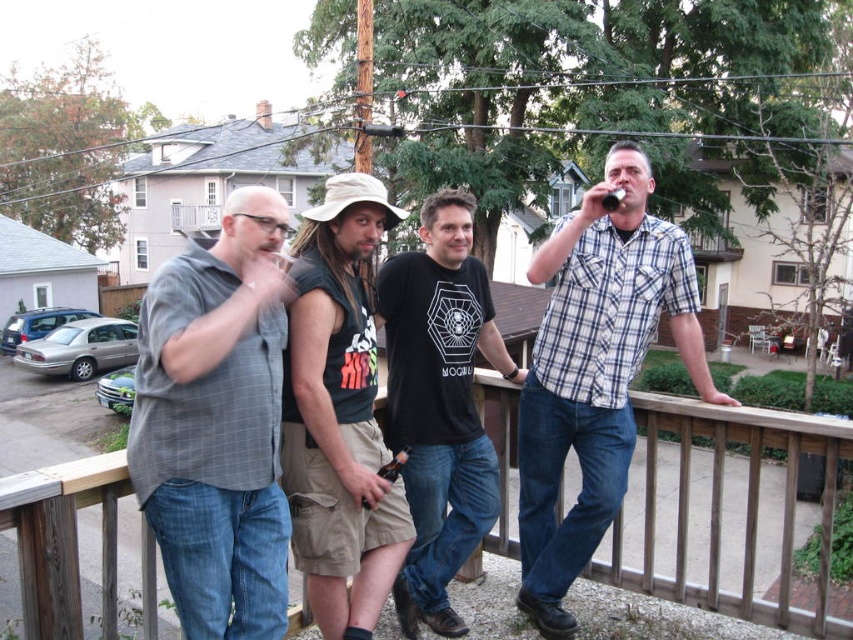
Is point (140, 490) farther from viewer compared to point (315, 307)?

No, it is in front of (315, 307).

Who is positioned more to the right, gray checkered shirt at left or khaki cotton shorts at center?

khaki cotton shorts at center is more to the right.

Locate an element on the screen. This screenshot has height=640, width=853. gray checkered shirt at left is located at coordinates (218, 422).

The height and width of the screenshot is (640, 853). I want to click on gray checkered shirt at left, so click(x=218, y=422).

Between gray checkered shirt at left and plaid cotton shirt at right, which one is positioned lower?

Positioned lower is plaid cotton shirt at right.

Between point (219, 296) and point (659, 236), which one is positioned behind?

Positioned behind is point (659, 236).

Between point (264, 616) and point (637, 195), which one is positioned in front?

Point (264, 616) is more forward.

You are a GUI agent. You are given a task and a screenshot of the screen. Output one action in this format:
    pyautogui.click(x=<x>, y=<y>)
    Task: Click on the gray checkered shirt at left
    The width and height of the screenshot is (853, 640).
    Given the screenshot: What is the action you would take?
    pos(218,422)

Between point (575, 336) and point (461, 374), which one is positioned behind?

The point (575, 336) is behind.

Measure the distance between point (643, 195) and camera.

Point (643, 195) is 3.27 meters from camera.

This screenshot has width=853, height=640. In order to click on plaid cotton shirt at right in this screenshot , I will do `click(595, 371)`.